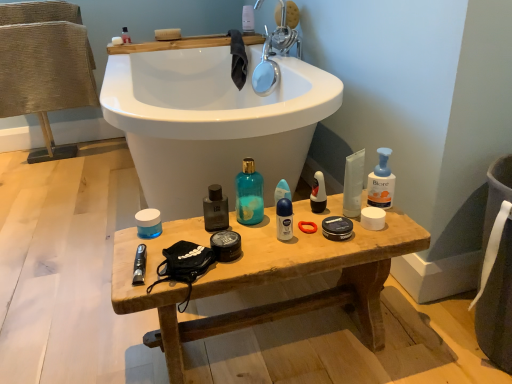
You are a GUI agent. You are given a task and a screenshot of the screen. Output one action in this format:
    pyautogui.click(x=<x>, y=<y>)
    Task: Click on the free space that is in between white matte deodorant at center, which ranks as the sixth toiletry in top-to-bottom order, and matte black bottle at center, positioned as the 2th toiletry in front-to-back order
    The image size is (512, 384).
    Given the screenshot: What is the action you would take?
    pyautogui.click(x=257, y=230)